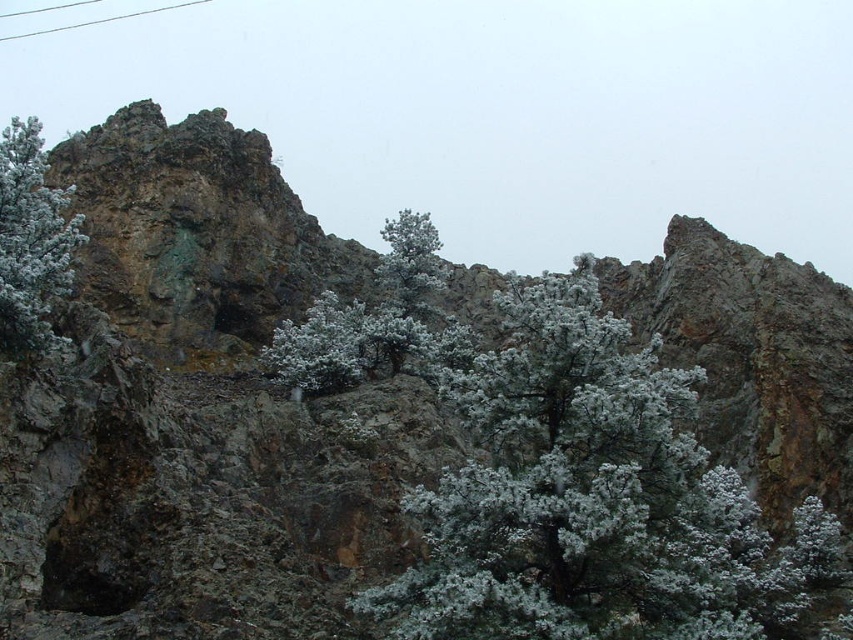
Can you confirm if snow-covered evergreen at center is thinner than snow-covered pine tree at left?

In fact, snow-covered evergreen at center might be wider than snow-covered pine tree at left.

At what (x,y) coordinates should I click in order to perform the action: click on snow-covered evergreen at center. Please return your answer as a coordinate pair (x, y). This screenshot has height=640, width=853. Looking at the image, I should click on click(x=595, y=499).

Find the location of a particular element. Image resolution: width=853 pixels, height=640 pixels. snow-covered evergreen at center is located at coordinates (595, 499).

Which is in front, point (668, 422) or point (425, 243)?

Positioned in front is point (668, 422).

Looking at this image, does snow-covered evergreen at center appear under white snow-covered tree at center?

Yes, snow-covered evergreen at center is below white snow-covered tree at center.

Locate an element on the screen. The width and height of the screenshot is (853, 640). snow-covered evergreen at center is located at coordinates (595, 499).

Is snow-covered pine tree at left wider than white snow-covered tree at center?

Correct, the width of snow-covered pine tree at left exceeds that of white snow-covered tree at center.

Between point (10, 176) and point (440, 284), which one is positioned behind?

Positioned behind is point (440, 284).

Find the location of a particular element. The width and height of the screenshot is (853, 640). snow-covered pine tree at left is located at coordinates (32, 241).